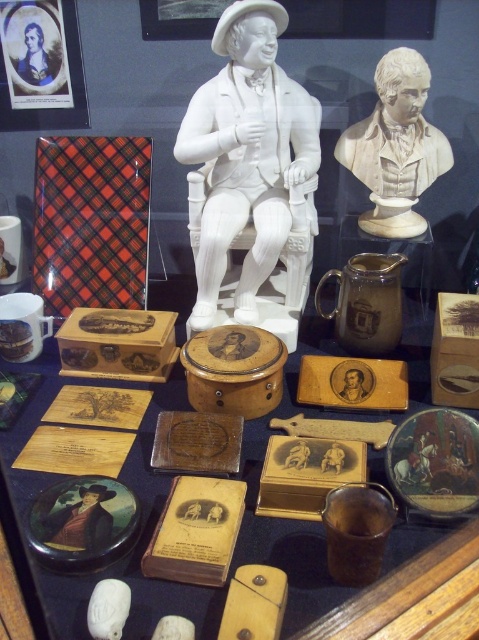
Does wooden box at center lie in front of matte wooden portrait at center?

Yes.

Does wooden box at center have a lesser width compared to matte wooden portrait at center?

Incorrect, wooden box at center's width is not less than matte wooden portrait at center's.

This screenshot has width=479, height=640. Describe the element at coordinates (241, 554) in the screenshot. I see `wooden box at center` at that location.

At what (x,y) coordinates should I click in order to perform the action: click on wooden box at center. Please return your answer as a coordinate pair (x, y). This screenshot has height=640, width=479. Looking at the image, I should click on (241, 554).

Is wooden box at center positioned in front of white porcelain statue at center?

Yes, it is.

What do you see at coordinates (241, 554) in the screenshot?
I see `wooden box at center` at bounding box center [241, 554].

Is point (0, 445) in front of point (229, 163)?

Yes, it is in front of point (229, 163).

What are the coordinates of `wooden box at center` in the screenshot? It's located at (241, 554).

Is white marble bust at upper right to the left of matte wooden portrait at center from the viewer's perspective?

No, white marble bust at upper right is not to the left of matte wooden portrait at center.

Based on the photo, measure the distance between white marble bust at upper right and camera.

The distance of white marble bust at upper right from camera is 1.53 meters.

Does point (417, 51) lie in front of point (87, 515)?

That is False.

At what (x,y) coordinates should I click in order to perform the action: click on white marble bust at upper right. Please return your answer as a coordinate pair (x, y). The width and height of the screenshot is (479, 640). Looking at the image, I should click on (396, 147).